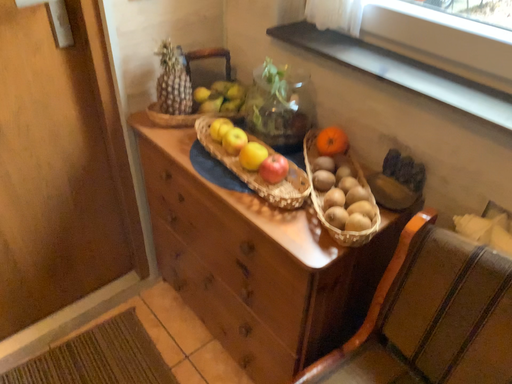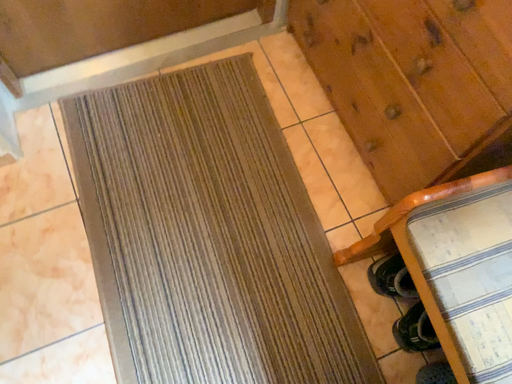
Question: Which way did the camera rotate in the video?

Choices:
 (A) rotated left
 (B) rotated right

Answer: (A)